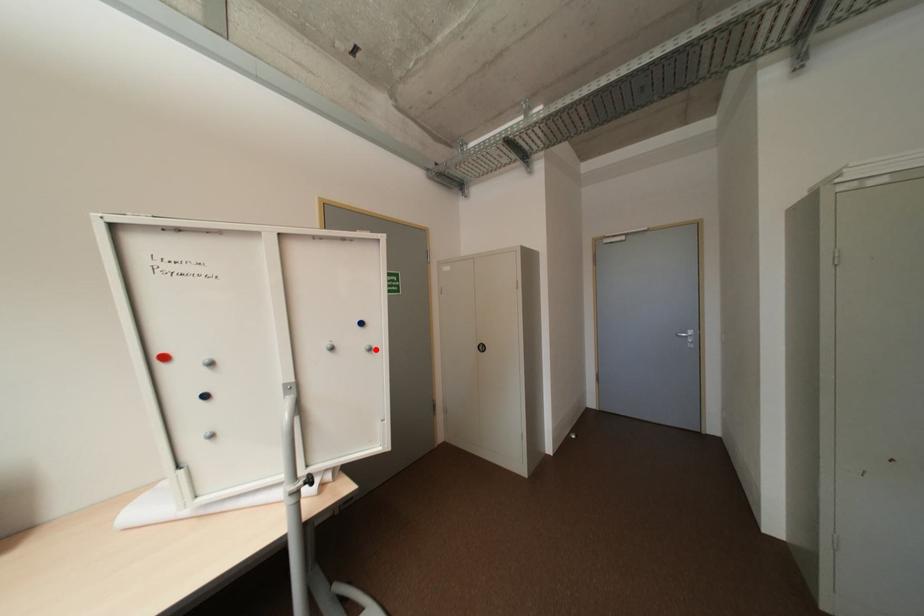
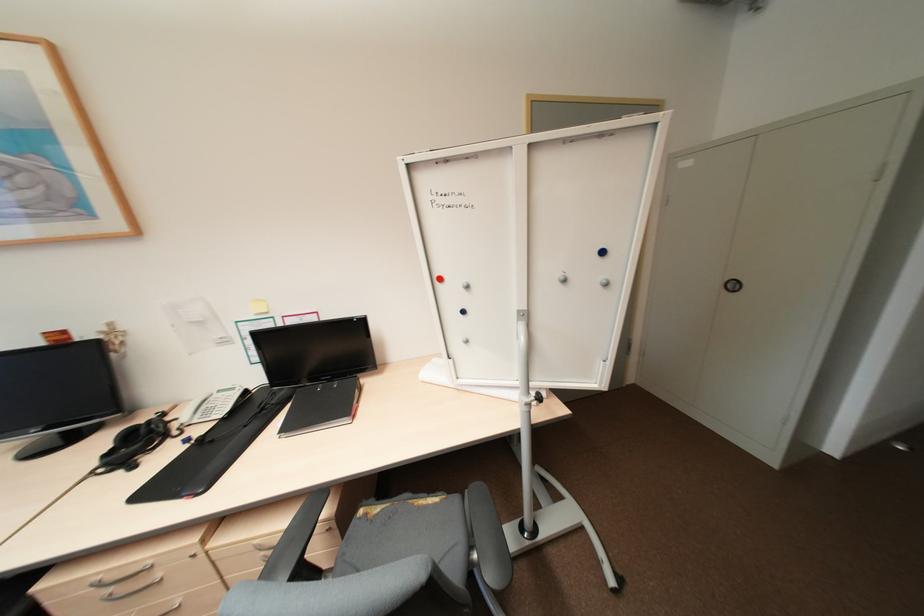
In the second image, find the point that corresponds to the highlighted location in the first image.

(612, 284)